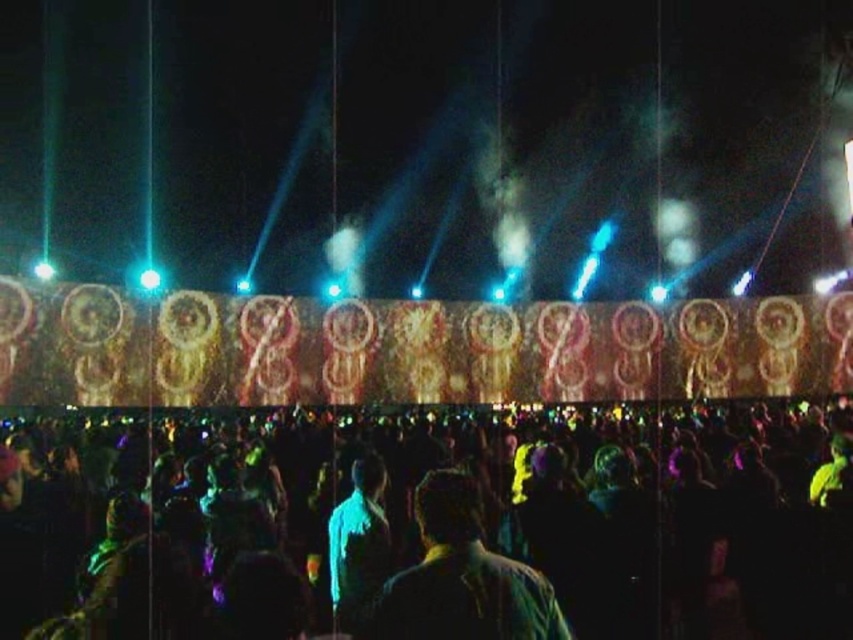
Between black fabric crowd at lower center and blue fabric at center, which one has less height?

Standing shorter between the two is blue fabric at center.

Where is `black fabric crowd at lower center`? black fabric crowd at lower center is located at coordinates (418, 529).

At what (x,y) coordinates should I click in order to perform the action: click on black fabric crowd at lower center. Please return your answer as a coordinate pair (x, y). This screenshot has height=640, width=853. Looking at the image, I should click on (418, 529).

Who is shorter, dark fabric shirt at center or blue fabric at center?

dark fabric shirt at center

Who is taller, dark fabric shirt at center or blue fabric at center?

blue fabric at center

The height and width of the screenshot is (640, 853). Find the location of `dark fabric shirt at center`. dark fabric shirt at center is located at coordinates (462, 577).

Between black fabric crowd at lower center and dark fabric shirt at center, which one has more height?

black fabric crowd at lower center

Can you confirm if black fabric crowd at lower center is positioned to the left of dark fabric shirt at center?

In fact, black fabric crowd at lower center is to the right of dark fabric shirt at center.

Locate an element on the screen. The height and width of the screenshot is (640, 853). black fabric crowd at lower center is located at coordinates (418, 529).